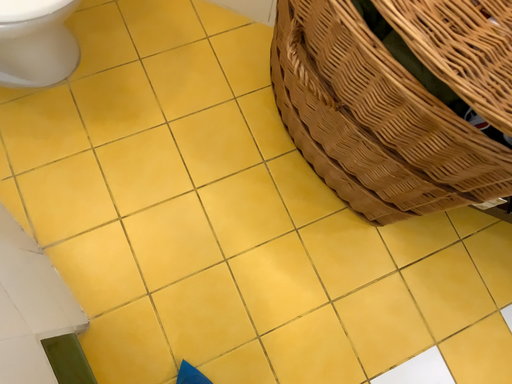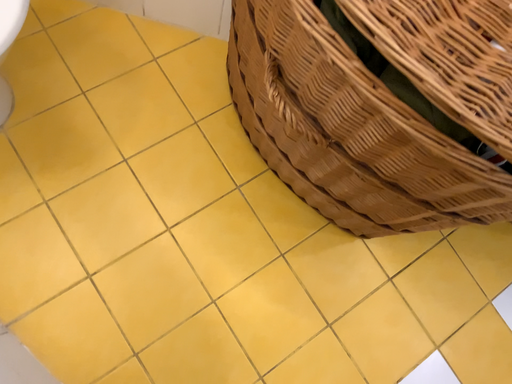
Question: How did the camera likely rotate when shooting the video?

Choices:
 (A) rotated left
 (B) rotated right

Answer: (B)